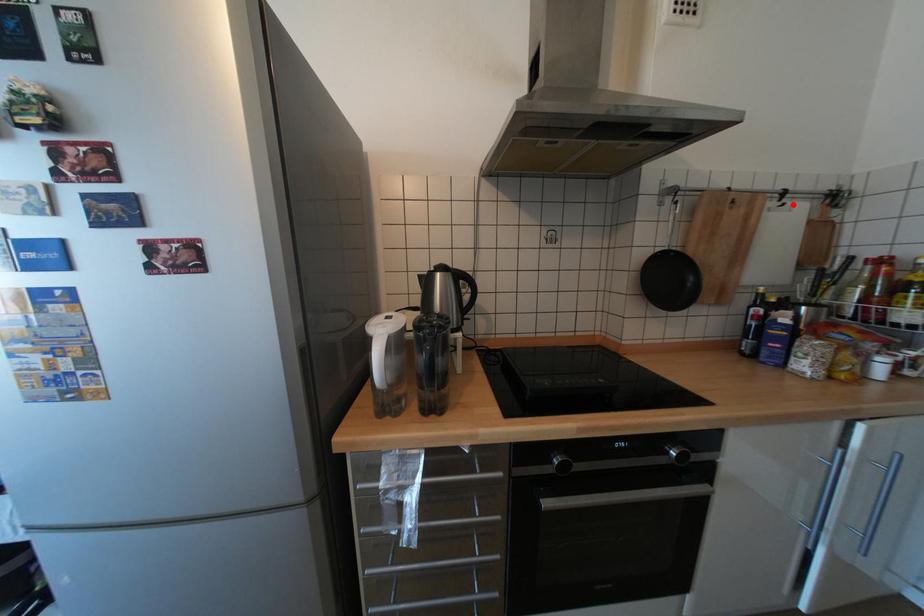
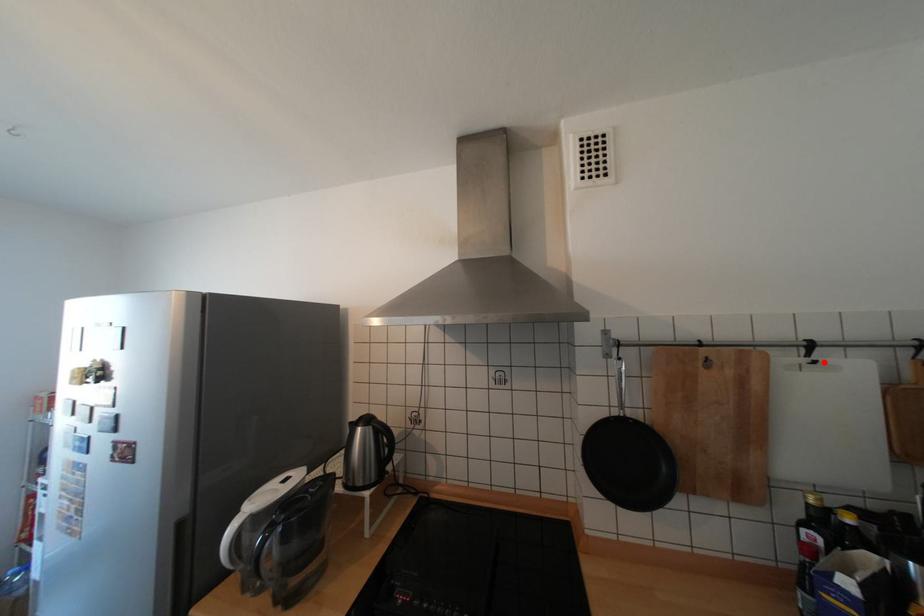
I am providing you with two images of the same scene from different viewpoints. A red point is marked on the first image and another point is marked on the second image. Do the highlighted points in image1 and image2 indicate the same real-world spot?

Yes